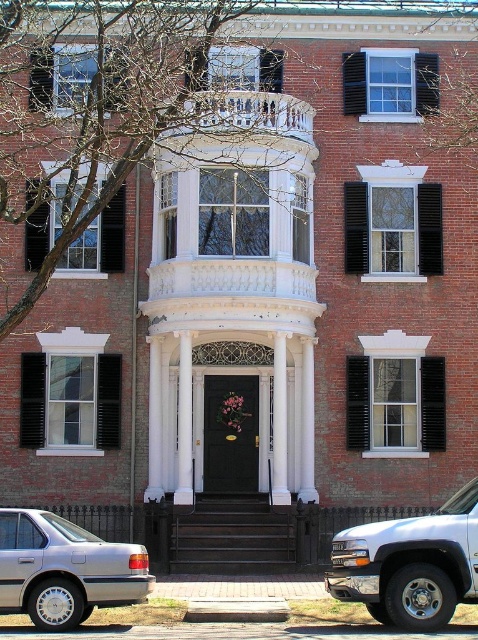
Can you confirm if white metallic suv at lower right is bigger than silver metallic sedan at lower left?

Yes.

Who is higher up, white metallic suv at lower right or silver metallic sedan at lower left?

Positioned higher is silver metallic sedan at lower left.

The image size is (478, 640). Find the location of `white metallic suv at lower right`. white metallic suv at lower right is located at coordinates (411, 564).

The width and height of the screenshot is (478, 640). Find the location of `white metallic suv at lower right`. white metallic suv at lower right is located at coordinates (411, 564).